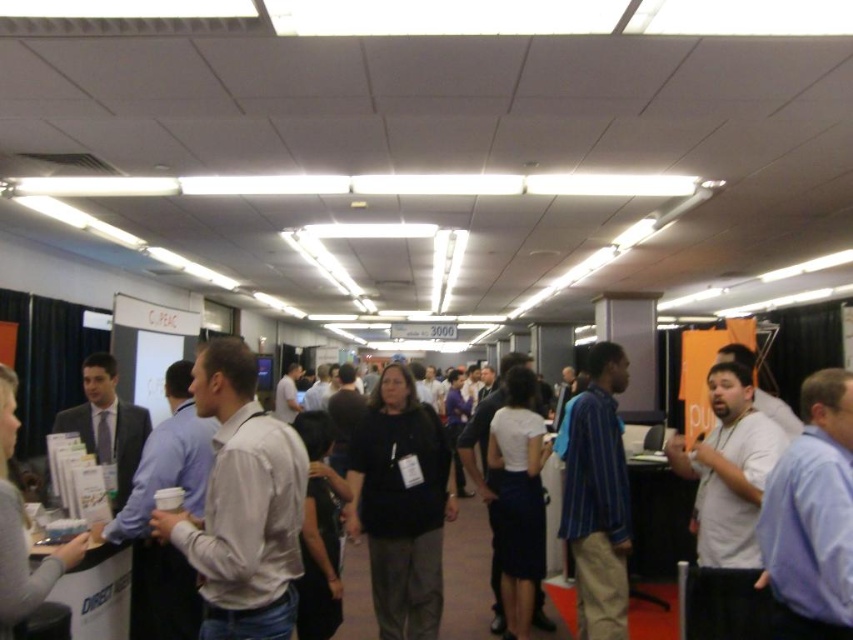
Question: Where is white shirt at left located in relation to light blue shirt at right in the image?

Choices:
 (A) above
 (B) below

Answer: (B)

Question: Which point is closer to the camera?

Choices:
 (A) matte black suit at left
 (B) striped cotton shirt at center
 (C) light blue shirt at right

Answer: (C)

Question: Where is black matte shirt at center located in relation to light blue shirt at right in the image?

Choices:
 (A) right
 (B) left

Answer: (B)

Question: Estimate the real-world distances between objects in this image. Which object is farther from the white shirt at left?

Choices:
 (A) white matte shirt at right
 (B) white paper at center

Answer: (B)

Question: Which of these objects is positioned farthest from the white shirt at left?

Choices:
 (A) matte black suit at left
 (B) white matte shirt at right
 (C) white paper at center

Answer: (C)

Question: Is black matte shirt at center positioned before striped cotton shirt at center?

Choices:
 (A) yes
 (B) no

Answer: (B)